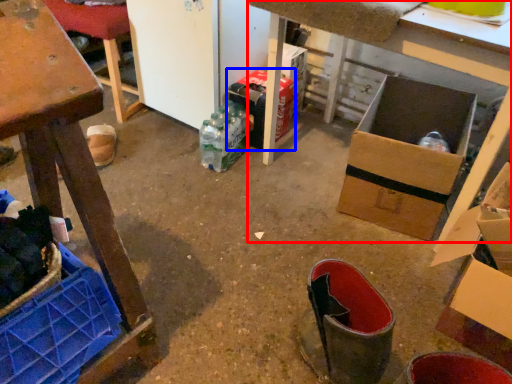
Question: Which object appears closest to the camera in this image, table (highlighted by a red box) or cardboard box (highlighted by a blue box)?

Choices:
 (A) table
 (B) cardboard box

Answer: (A)